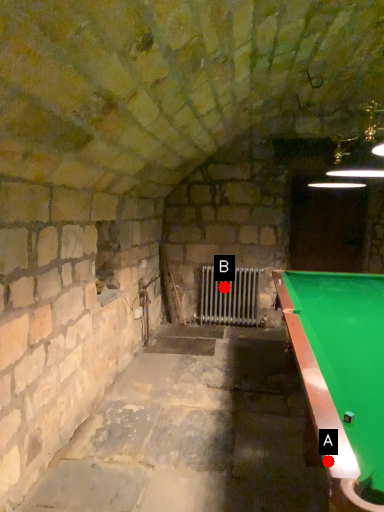
Question: Two points are circled on the image, labeled by A and B beside each circle. Which point appears closest to the camera in this image?

Choices:
 (A) A is closer
 (B) B is closer

Answer: (A)